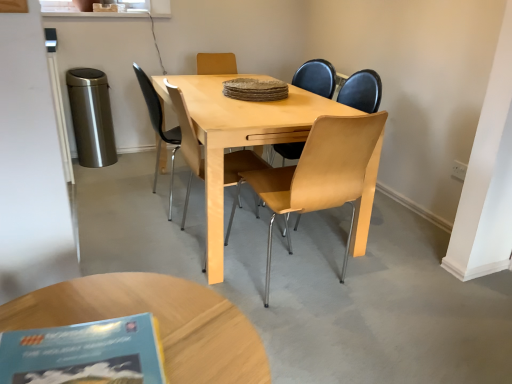
Question: Is light wood/metallic chair at center, the first chair in the right-to-left sequence, positioned far away from light brown wood chair at center, which is counted as the 2th chair, starting from the right?

Choices:
 (A) yes
 (B) no

Answer: (B)

Question: Considering the relative positions of light wood/metallic chair at center, marked as the second chair in a left-to-right arrangement, and light brown wood chair at center, positioned as the 1th chair in left-to-right order, in the image provided, is light wood/metallic chair at center, marked as the second chair in a left-to-right arrangement, in front of light brown wood chair at center, positioned as the 1th chair in left-to-right order,?

Choices:
 (A) yes
 (B) no

Answer: (A)

Question: Can you confirm if light wood/metallic chair at center, marked as the second chair in a left-to-right arrangement, is positioned to the left of light brown wood chair at center, positioned as the 1th chair in left-to-right order?

Choices:
 (A) no
 (B) yes

Answer: (A)

Question: Can light brown wood chair at center, which is counted as the 2th chair, starting from the right, be found inside light wood/metallic chair at center, marked as the second chair in a left-to-right arrangement?

Choices:
 (A) no
 (B) yes

Answer: (A)

Question: Is light wood/metallic chair at center, marked as the second chair in a left-to-right arrangement, further to camera compared to light brown wood chair at center, which is counted as the 2th chair, starting from the right?

Choices:
 (A) no
 (B) yes

Answer: (A)

Question: Can you confirm if light wood/metallic chair at center, the first chair in the right-to-left sequence, is taller than light brown wood chair at center, which is counted as the 2th chair, starting from the right?

Choices:
 (A) no
 (B) yes

Answer: (A)

Question: Is light brown wood chair at center, which is counted as the 2th chair, starting from the right, thinner than blue paper book at lower left?

Choices:
 (A) yes
 (B) no

Answer: (B)

Question: Is light brown wood chair at center, positioned as the 1th chair in left-to-right order, to the left of blue paper book at lower left from the viewer's perspective?

Choices:
 (A) no
 (B) yes

Answer: (A)

Question: From a real-world perspective, is light brown wood chair at center, positioned as the 1th chair in left-to-right order, below blue paper book at lower left?

Choices:
 (A) yes
 (B) no

Answer: (A)

Question: From the image's perspective, is light brown wood chair at center, which is counted as the 2th chair, starting from the right, over blue paper book at lower left?

Choices:
 (A) yes
 (B) no

Answer: (A)

Question: Can you confirm if light brown wood chair at center, positioned as the 1th chair in left-to-right order, is positioned to the right of blue paper book at lower left?

Choices:
 (A) no
 (B) yes

Answer: (B)

Question: Can you confirm if light brown wood chair at center, which is counted as the 2th chair, starting from the right, is wider than blue paper book at lower left?

Choices:
 (A) no
 (B) yes

Answer: (B)

Question: Is blue paper book at lower left oriented towards light brown wooden coffee table at lower center?

Choices:
 (A) no
 (B) yes

Answer: (A)